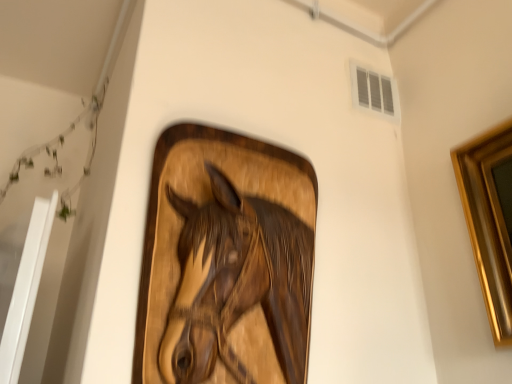
Describe the element at coordinates (374, 92) in the screenshot. The width and height of the screenshot is (512, 384). I see `white plastic vent at upper right` at that location.

Where is `white plastic vent at upper right`? This screenshot has width=512, height=384. white plastic vent at upper right is located at coordinates (374, 92).

What do you see at coordinates (237, 283) in the screenshot? I see `wooden horse at center` at bounding box center [237, 283].

Locate an element on the screen. wooden horse at center is located at coordinates (237, 283).

Image resolution: width=512 pixels, height=384 pixels. I want to click on white plastic vent at upper right, so click(374, 92).

Considering the relative positions of white plastic vent at upper right and wooden horse at center in the image provided, is white plastic vent at upper right to the left or to the right of wooden horse at center?

white plastic vent at upper right is to the right of wooden horse at center.

Is white plastic vent at upper right further to the viewer compared to wooden horse at center?

Yes, it is behind wooden horse at center.

Considering the points (353, 89) and (239, 313), which point is in front, point (353, 89) or point (239, 313)?

The point (239, 313) is closer to the camera.

From the image's perspective, which is below, white plastic vent at upper right or wooden horse at center?

wooden horse at center, from the image's perspective.

From a real-world perspective, between white plastic vent at upper right and wooden horse at center, who is vertically higher?

white plastic vent at upper right.

Is white plastic vent at upper right wider or thinner than wooden horse at center?

In the image, white plastic vent at upper right appears to be more narrow than wooden horse at center.

Considering the relative sizes of white plastic vent at upper right and wooden horse at center in the image provided, is white plastic vent at upper right shorter than wooden horse at center?

Indeed, white plastic vent at upper right has a lesser height compared to wooden horse at center.

Considering the sizes of objects white plastic vent at upper right and wooden horse at center in the image provided, who is bigger, white plastic vent at upper right or wooden horse at center?

With larger size is wooden horse at center.

Is white plastic vent at upper right not within wooden horse at center?

Yes.

Is white plastic vent at upper right directly adjacent to wooden horse at center?

white plastic vent at upper right and wooden horse at center are clearly separated.

Is wooden horse at center at the back of white plastic vent at upper right?

No, white plastic vent at upper right's orientation is not away from wooden horse at center.

How many degrees apart are the facing directions of white plastic vent at upper right and wooden horse at center?

There is a 0.014-degree angle between the facing directions of white plastic vent at upper right and wooden horse at center.

The width and height of the screenshot is (512, 384). Identify the location of window to the right of wooden horse at center. (374, 92).

Which is more to the left, wooden horse at center or white plastic vent at upper right?

Positioned to the left is wooden horse at center.

Does wooden horse at center come behind white plastic vent at upper right?

No, the depth of wooden horse at center is less than that of white plastic vent at upper right.

Is point (308, 296) closer or farther from the camera than point (353, 89)?

Point (308, 296) is closer to the camera than point (353, 89).

From the image's perspective, is wooden horse at center beneath white plastic vent at upper right?

Yes, from the image's perspective, wooden horse at center is below white plastic vent at upper right.

From a real-world perspective, between wooden horse at center and white plastic vent at upper right, who is vertically higher?

white plastic vent at upper right, from a real-world perspective.

Considering the sizes of wooden horse at center and white plastic vent at upper right in the image, is wooden horse at center wider or thinner than white plastic vent at upper right?

Clearly, wooden horse at center has more width compared to white plastic vent at upper right.

Looking at this image, considering the sizes of objects wooden horse at center and white plastic vent at upper right in the image provided, who is shorter, wooden horse at center or white plastic vent at upper right?

white plastic vent at upper right.

Considering the relative sizes of wooden horse at center and white plastic vent at upper right in the image provided, is wooden horse at center smaller than white plastic vent at upper right?

No, wooden horse at center is not smaller than white plastic vent at upper right.

Is white plastic vent at upper right completely or partially inside wooden horse at center?

No, white plastic vent at upper right is not inside wooden horse at center.

Is wooden horse at center positioned far away from white plastic vent at upper right?

wooden horse at center is actually quite close to white plastic vent at upper right.

Does wooden horse at center turn towards white plastic vent at upper right?

No, wooden horse at center is not aimed at white plastic vent at upper right.

What's the angular difference between wooden horse at center and white plastic vent at upper right's facing directions?

The angular difference between wooden horse at center and white plastic vent at upper right is 0.014 degrees.

How much distance is there between wooden horse at center and white plastic vent at upper right?

wooden horse at center is 63.70 centimeters away from white plastic vent at upper right.

This screenshot has height=384, width=512. In order to click on window to the right of wooden horse at center in this screenshot , I will do `click(374, 92)`.

At what (x,y) coordinates should I click in order to perform the action: click on horse lying in front of the white plastic vent at upper right. Please return your answer as a coordinate pair (x, y). The height and width of the screenshot is (384, 512). Looking at the image, I should click on (237, 283).

The height and width of the screenshot is (384, 512). In order to click on window above the wooden horse at center (from the image's perspective) in this screenshot , I will do `click(374, 92)`.